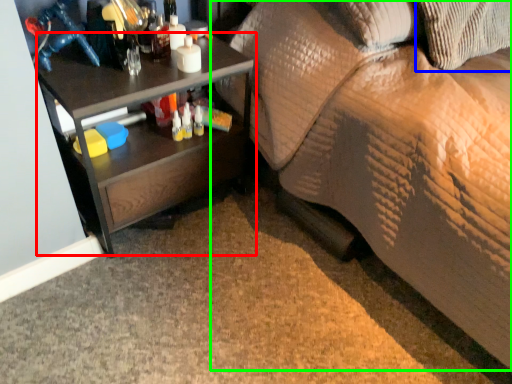
Question: Based on their relative distances, which object is farther from desk (highlighted by a red box)? Choose from pillow (highlighted by a blue box) and studio couch (highlighted by a green box).

Choices:
 (A) pillow
 (B) studio couch

Answer: (A)